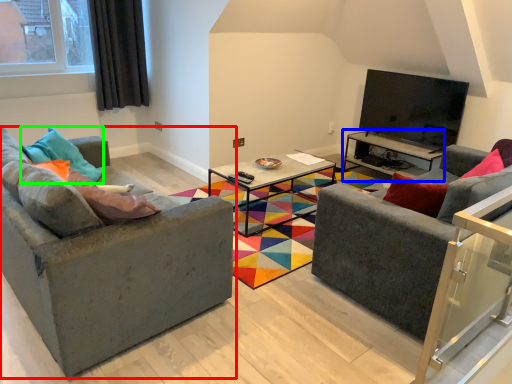
Question: Which object is the closest to the studio couch (highlighted by a red box)? Choose among these: table (highlighted by a blue box) or pillow (highlighted by a green box).

Choices:
 (A) table
 (B) pillow

Answer: (B)